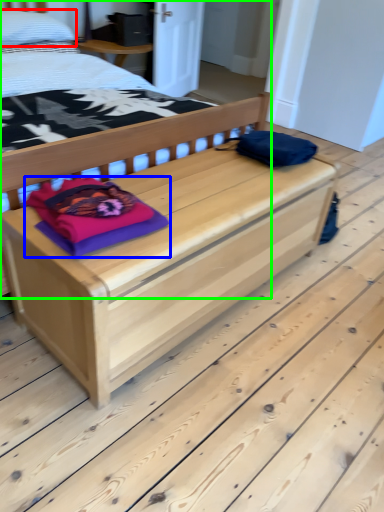
Question: Considering the real-world distances, which object is farthest from pillow (highlighted by a red box)? material (highlighted by a blue box) or bed (highlighted by a green box)?

Choices:
 (A) material
 (B) bed

Answer: (A)